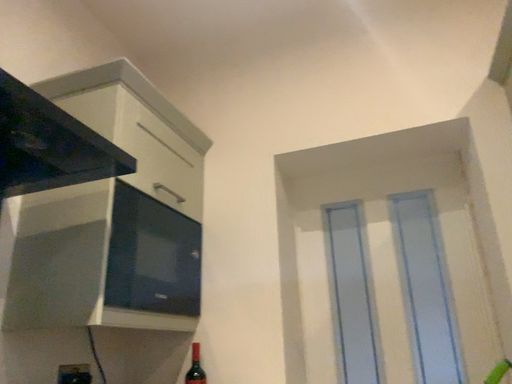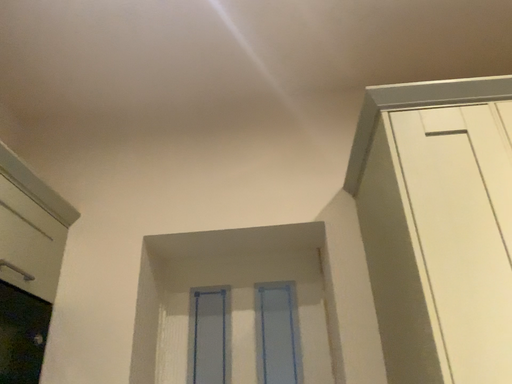
Question: How did the camera likely rotate when shooting the video?

Choices:
 (A) rotated downward
 (B) rotated upward

Answer: (B)